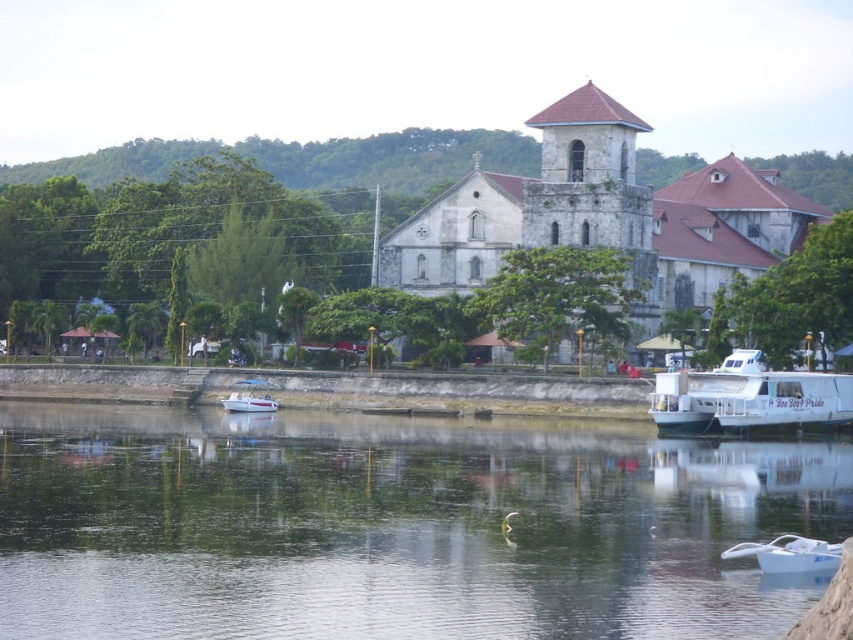
Question: Does white stone church at center appear over white glossy boat at right?

Choices:
 (A) yes
 (B) no

Answer: (A)

Question: Considering the real-world distances, which object is farthest from the white matte boat at lower right?

Choices:
 (A) transparent water at lower center
 (B) white glossy boat at center
 (C) white stone church at center

Answer: (C)

Question: Estimate the real-world distances between objects in this image. Which object is closer to the white stone church at center?

Choices:
 (A) transparent water at lower center
 (B) white glossy boat at center
 (C) white glossy boat at right

Answer: (C)

Question: Estimate the real-world distances between objects in this image. Which object is closer to the white stone church at center?

Choices:
 (A) transparent water at lower center
 (B) white matte boat at lower right
 (C) white glossy boat at center
 (D) white glossy boat at right

Answer: (D)

Question: Can you confirm if white glossy boat at right is positioned above white glossy boat at center?

Choices:
 (A) no
 (B) yes

Answer: (B)

Question: Is transparent water at lower center to the left of white matte boat at lower right from the viewer's perspective?

Choices:
 (A) no
 (B) yes

Answer: (B)